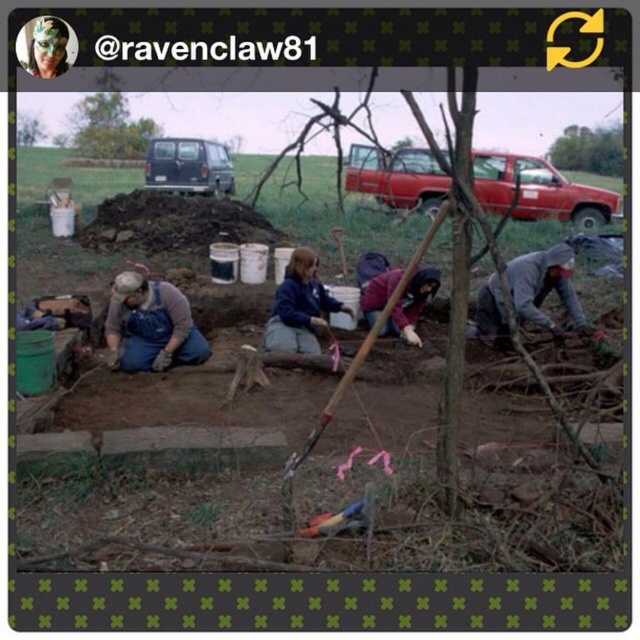
Can you confirm if blue denim overalls at lower left is positioned to the right of green matte mask at upper left?

Correct, you'll find blue denim overalls at lower left to the right of green matte mask at upper left.

Who is more distant from viewer, (108,358) or (35,48)?

Point (35,48)

You are a GUI agent. You are given a task and a screenshot of the screen. Output one action in this format:
    pyautogui.click(x=<x>, y=<y>)
    Task: Click on the blue denim overalls at lower left
    The width and height of the screenshot is (640, 640).
    Given the screenshot: What is the action you would take?
    pyautogui.click(x=150, y=324)

Which of these two, blue denim overalls at lower left or gray matte jacket at lower right, stands taller?

With more height is gray matte jacket at lower right.

Which is behind, point (156, 317) or point (564, 310)?

Point (564, 310)

Does point (163, 317) come behind point (502, 337)?

No, it is in front of (502, 337).

This screenshot has height=640, width=640. Identify the location of blue denim overalls at lower left. (150, 324).

Does green matte mask at upper left appear on the right side of green leafy tree at upper left?

Indeed, green matte mask at upper left is positioned on the right side of green leafy tree at upper left.

Can you confirm if green matte mask at upper left is positioned above green leafy tree at upper left?

No.

At what (x,y) coordinates should I click in order to perform the action: click on green matte mask at upper left. Please return your answer as a coordinate pair (x, y). Looking at the image, I should click on (48, 48).

Identify the location of green matte mask at upper left. The height and width of the screenshot is (640, 640). (48, 48).